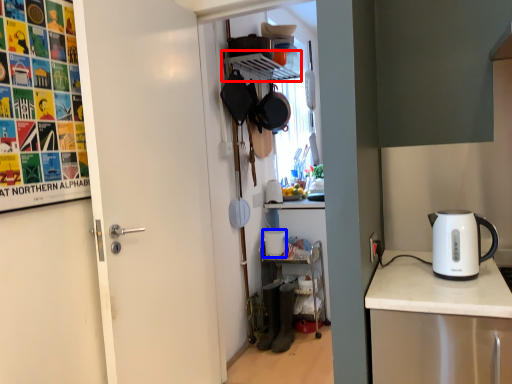
Question: Which point is closer to the camera, shelf (highlighted by a red box) or appliance (highlighted by a blue box)?

Choices:
 (A) shelf
 (B) appliance

Answer: (A)